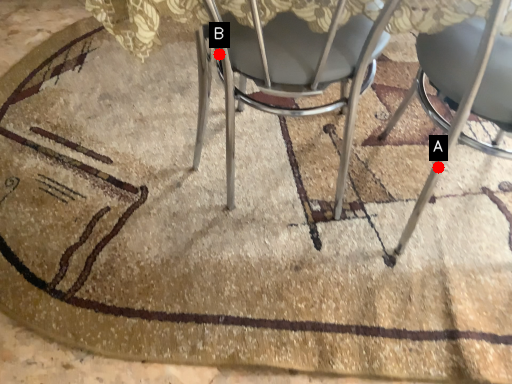
Question: Two points are circled on the image, labeled by A and B beside each circle. Which point is closer to the camera?

Choices:
 (A) A is closer
 (B) B is closer

Answer: (B)